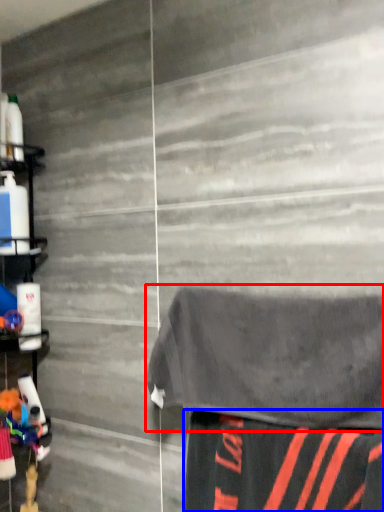
Question: Which of the following is the farthest to the observer, bath towel (highlighted by a red box) or fabric (highlighted by a blue box)?

Choices:
 (A) bath towel
 (B) fabric

Answer: (A)